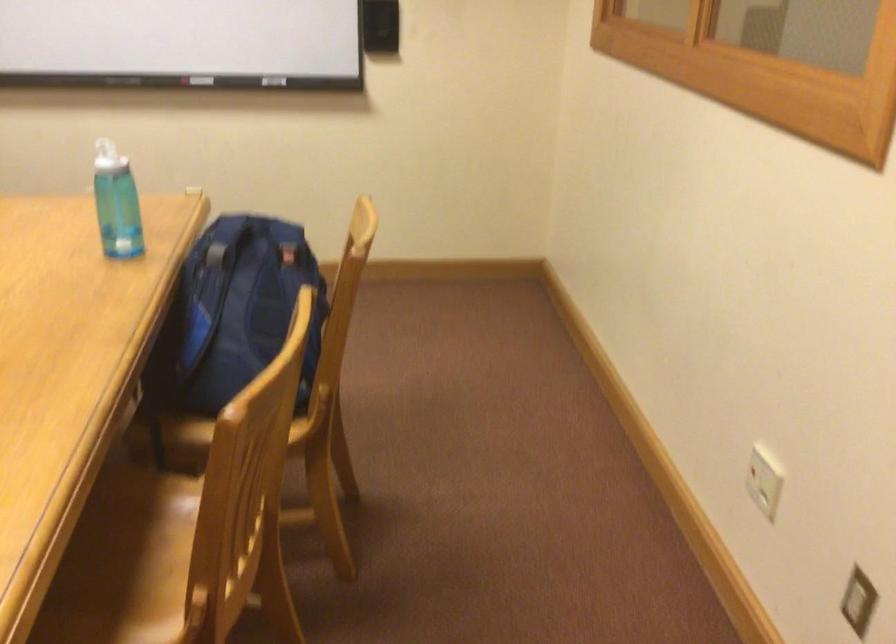
In order to click on backpack top handle in this screenshot , I will do `click(254, 225)`.